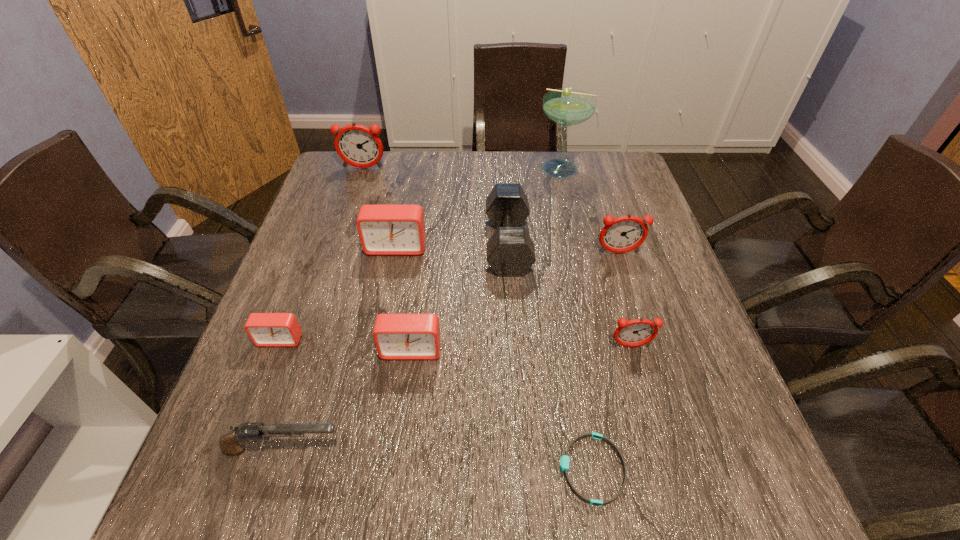
Where is `the smallest red alarm clock`? the smallest red alarm clock is located at coordinates (264, 329).

Find the location of a particular element. Image resolution: width=960 pixels, height=540 pixels. the leftmost red alarm clock is located at coordinates (264, 329).

Find the location of `the shortest object`. the shortest object is located at coordinates (564, 461).

Locate an element on the screen. The height and width of the screenshot is (540, 960). gray wristband is located at coordinates (564, 461).

Where is `free region located 0.090m on the left of the green martini`? Image resolution: width=960 pixels, height=540 pixels. free region located 0.090m on the left of the green martini is located at coordinates (507, 168).

Locate an element on the screen. The image size is (960, 540). vacant space located on the front-facing side of the leftmost reddish-pink alarm clock is located at coordinates (332, 262).

I want to click on vacant space located 0.210m on the front-facing side of the second smallest reddish-pink alarm clock, so click(x=641, y=325).

The height and width of the screenshot is (540, 960). In order to click on free point located on the front-facing side of the farthest red alarm clock in this screenshot , I will do `click(371, 379)`.

Locate an element on the screen. This screenshot has height=540, width=960. free space located 0.360m on the front of the fifth object from right to left is located at coordinates (520, 421).

The image size is (960, 540). In order to click on vacant region located on the front-facing side of the second smallest red alarm clock in this screenshot , I will do `click(405, 398)`.